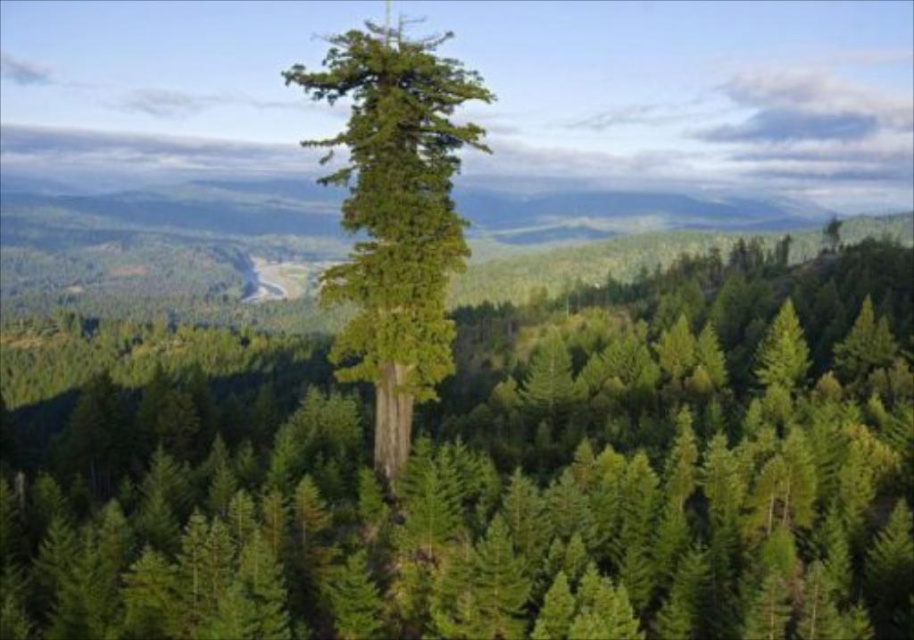
You are standing in the forest and want to locate the green textured tree at center. According to the coordinates provided, where would you find it?

The green textured tree at center is located at point (482,468).

You are an environmental scientist assessing tree health in the forest. You observe the green textured tree at center and the green rough bark tree at center. Which tree has a larger width according to your measurements?

The green textured tree at center has a larger width than the green rough bark tree at center.